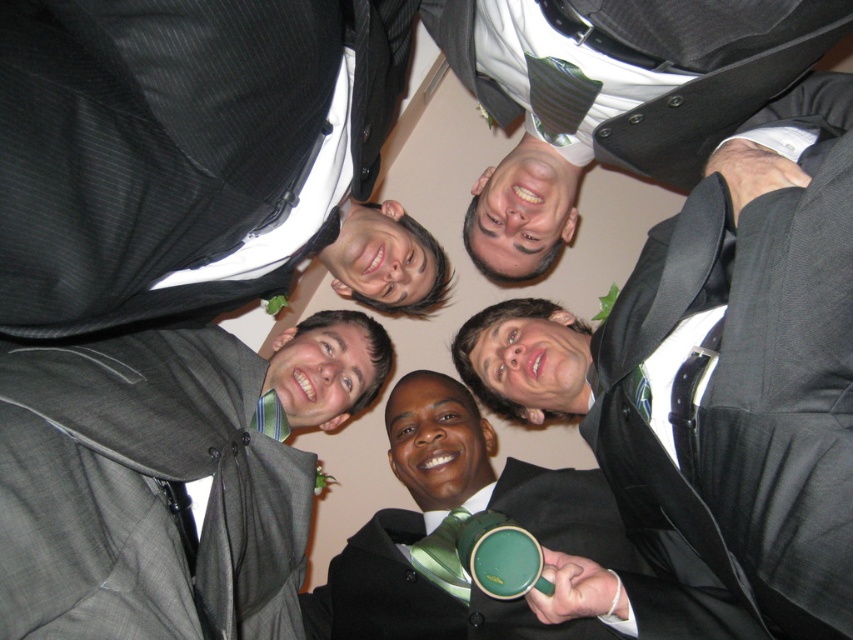
Question: Which point is closer to the camera taking this photo?

Choices:
 (A) (132, 518)
 (B) (726, 275)
 (C) (329, 211)
 (D) (486, 609)

Answer: (A)

Question: Which of the following is the closest to the observer?

Choices:
 (A) (567, 550)
 (B) (189, 45)
 (C) (415, 545)
 (D) (706, 163)

Answer: (B)

Question: Does matte black suit at upper left have a larger size compared to matte gray suit at upper left?

Choices:
 (A) yes
 (B) no

Answer: (A)

Question: Which of the following is the farthest from the observer?

Choices:
 (A) matte black suit at upper left
 (B) green silk tie at center
 (C) green striped tie at center
 (D) matte gray suit at upper left

Answer: (C)

Question: Can you confirm if matte gray suit at upper left is positioned below green silk tie at center?

Choices:
 (A) yes
 (B) no

Answer: (B)

Question: Is shiny black suit at center above matte black suit at upper left?

Choices:
 (A) no
 (B) yes

Answer: (A)